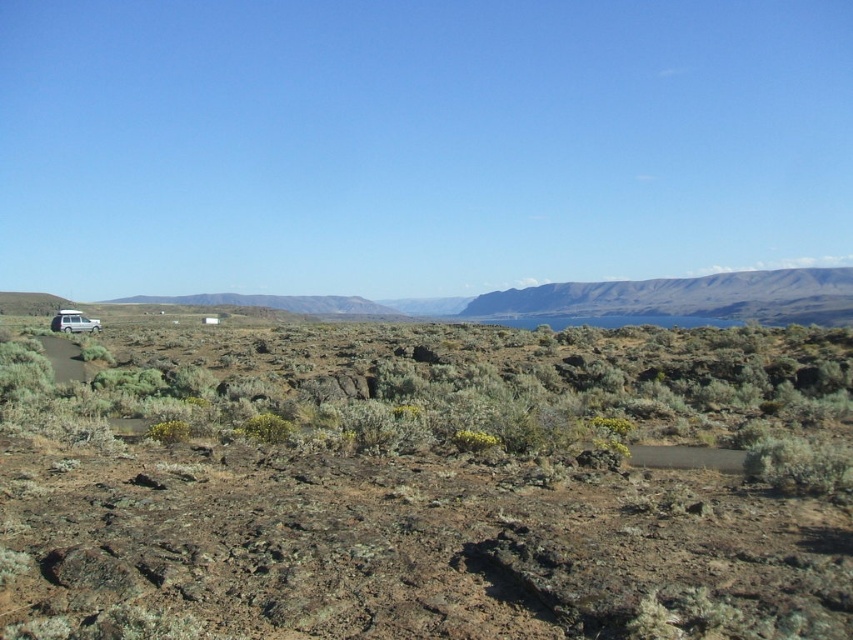
You are a hiker planning to drive your silver metallic suv at left through the brown rocky terrain at left. Based on the scene, can you safely navigate the terrain with your vehicle?

The brown rocky terrain at left is in front of the silver metallic suv at left, which means the suv is positioned behind the rocky area. Since the suv is parked on the dirt path, it can safely navigate the terrain as long as the rocky area is passable. However, the description does not provide specific details about the terrain difficulty, so caution is advised.

You are planning to drive the silver metallic suv at left across the brown rocky terrain at left. Based on the terrain width and vehicle width, will the suv have enough space to navigate the terrain without going off the path?

The brown rocky terrain at left is wider than the silver metallic suv at left, so the suv will have enough space to navigate the terrain without going off the path.